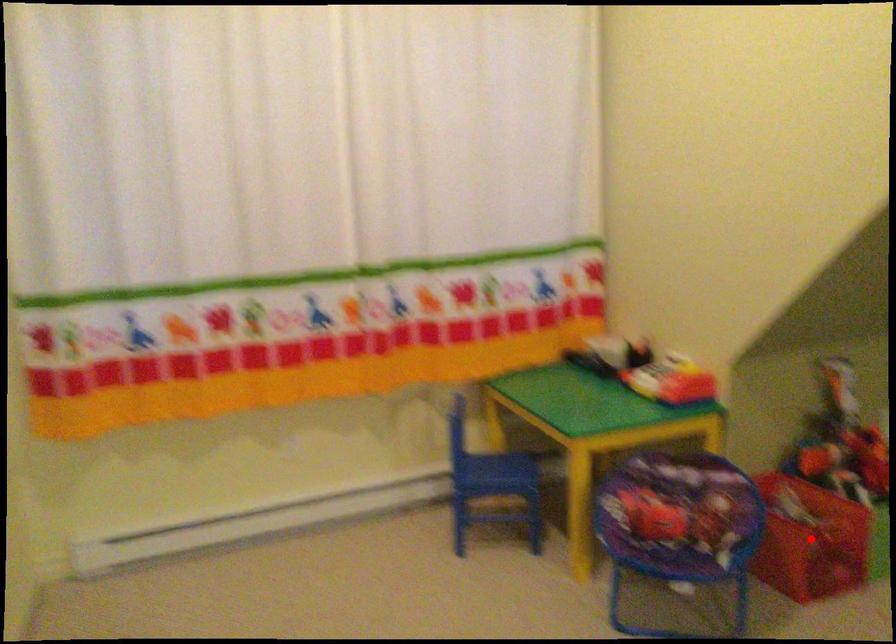
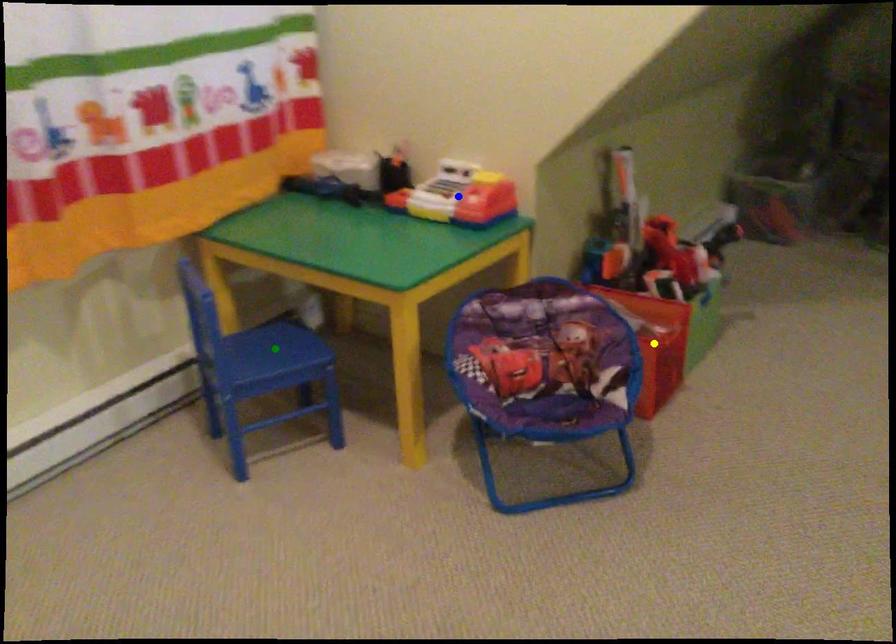
Question: I am providing you with two images of the same scene from different viewpoints. A red point is marked on the first image. You are given multiple points on the second image. Can you choose the point in image 2 that corresponds to the point in image 1?

Choices:
 (A) green point
 (B) blue point
 (C) yellow point

Answer: (C)